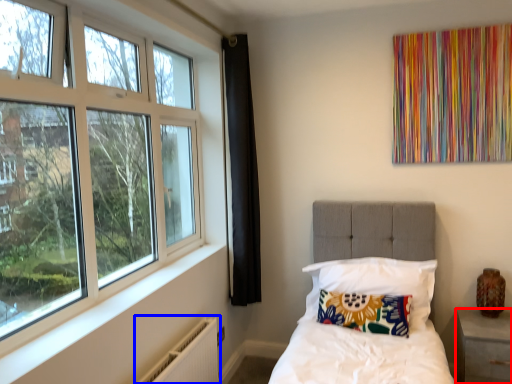
Question: Which object appears farthest to the camera in this image, nightstand (highlighted by a red box) or radiator (highlighted by a blue box)?

Choices:
 (A) nightstand
 (B) radiator

Answer: (A)